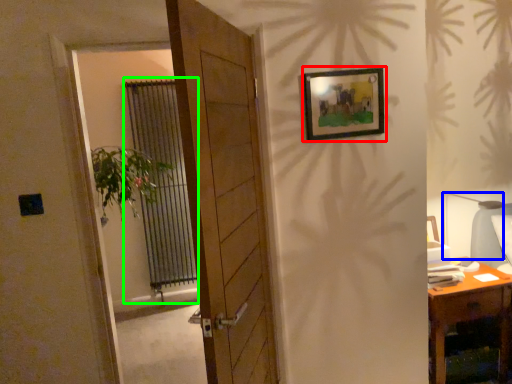
Question: Based on their relative distances, which object is farther from picture frame (highlighted by a red box)? Choose from table lamp (highlighted by a blue box) and curtain (highlighted by a green box).

Choices:
 (A) table lamp
 (B) curtain

Answer: (B)